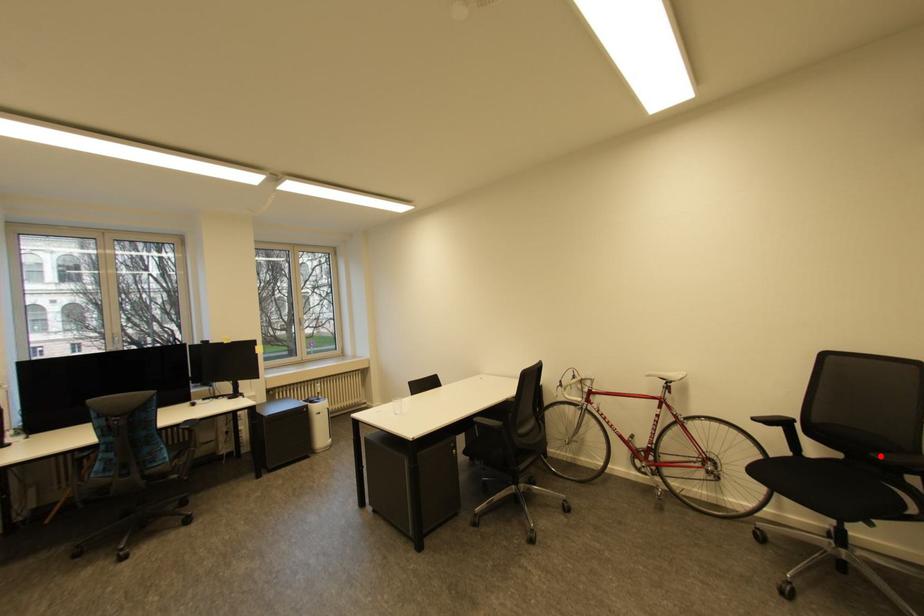
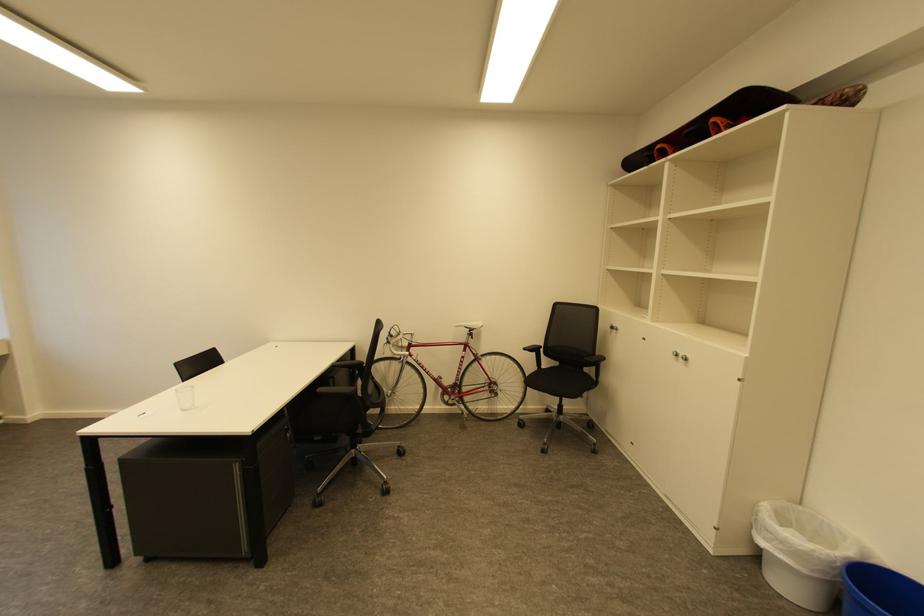
Question: A red point is marked in image1. In image2, is the corresponding 3D point closer to the camera or farther? Reply with the corresponding letter.

Choices:
 (A) The corresponding 3D point is closer.
 (B) The corresponding 3D point is farther.

Answer: (A)